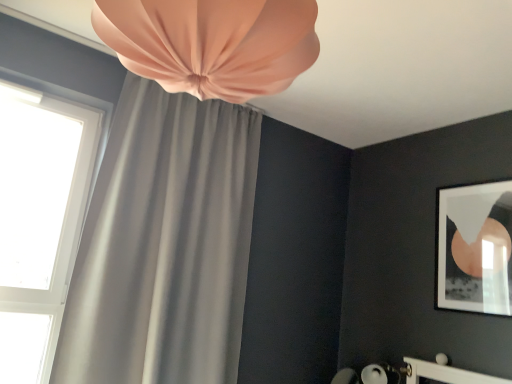
This screenshot has width=512, height=384. In order to click on matte gray curtain at upper left, the 2th curtain in the front-to-back sequence in this screenshot , I will do `click(164, 244)`.

Where is `matte gray curtain at upper left, the first curtain when ordered from front to back`? Image resolution: width=512 pixels, height=384 pixels. matte gray curtain at upper left, the first curtain when ordered from front to back is located at coordinates (212, 43).

Considering the points (498, 197) and (275, 7), which point is behind, point (498, 197) or point (275, 7)?

The point (498, 197) is farther.

Locate an element on the screen. the 2nd curtain in front when counting from the matte black frame at upper right is located at coordinates (212, 43).

Can you confirm if matte black frame at upper right is thinner than matte gray curtain at upper left, the first curtain when ordered from front to back?

Indeed, matte black frame at upper right has a lesser width compared to matte gray curtain at upper left, the first curtain when ordered from front to back.

Measure the distance between matte black frame at upper right and matte gray curtain at upper left, the 2th curtain when ordered from back to front.

They are 1.94 meters apart.

From the image's perspective, between matte gray curtain at upper left, the 2th curtain when ordered from back to front, and white glass window at upper left, who is located below?

white glass window at upper left.

Is matte gray curtain at upper left, the first curtain when ordered from front to back, far from white glass window at upper left?

Yes, matte gray curtain at upper left, the first curtain when ordered from front to back, is far from white glass window at upper left.

Considering the sizes of matte gray curtain at upper left, the first curtain when ordered from front to back, and white glass window at upper left in the image, is matte gray curtain at upper left, the first curtain when ordered from front to back, taller or shorter than white glass window at upper left?

Clearly, matte gray curtain at upper left, the first curtain when ordered from front to back, is shorter compared to white glass window at upper left.

Which object is thinner, matte gray curtain at upper left, the first curtain when ordered from front to back, or white glass window at upper left?

Thinner between the two is white glass window at upper left.

How different are the orientations of matte black frame at upper right and matte gray curtain at upper left, the 2th curtain in the front-to-back sequence, in degrees?

91 degrees.

Which object is further away from the camera taking this photo, matte black frame at upper right or matte gray curtain at upper left, the 1th curtain in the back-to-front sequence?

Positioned behind is matte black frame at upper right.

Is matte black frame at upper right facing towards matte gray curtain at upper left, the 2th curtain in the front-to-back sequence?

No, matte black frame at upper right is not turned towards matte gray curtain at upper left, the 2th curtain in the front-to-back sequence.

Do you think matte black frame at upper right is within matte gray curtain at upper left, the 1th curtain in the back-to-front sequence, or outside of it?

matte black frame at upper right is located beyond the bounds of matte gray curtain at upper left, the 1th curtain in the back-to-front sequence.

Is matte gray curtain at upper left, the 2th curtain when ordered from back to front, next to matte gray curtain at upper left, the 2th curtain in the front-to-back sequence?

No, matte gray curtain at upper left, the 2th curtain when ordered from back to front, is not with matte gray curtain at upper left, the 2th curtain in the front-to-back sequence.

Considering the positions of objects matte gray curtain at upper left, the 2th curtain when ordered from back to front, and matte gray curtain at upper left, the 2th curtain in the front-to-back sequence, in the image provided, who is more to the right, matte gray curtain at upper left, the 2th curtain when ordered from back to front, or matte gray curtain at upper left, the 2th curtain in the front-to-back sequence,?

From the viewer's perspective, matte gray curtain at upper left, the 2th curtain when ordered from back to front, appears more on the right side.

Is matte gray curtain at upper left, the first curtain when ordered from front to back, outside of matte gray curtain at upper left, the 1th curtain in the back-to-front sequence?

That's correct, matte gray curtain at upper left, the first curtain when ordered from front to back, is outside of matte gray curtain at upper left, the 1th curtain in the back-to-front sequence.

Does matte gray curtain at upper left, the 2th curtain when ordered from back to front, turn towards matte gray curtain at upper left, the 1th curtain in the back-to-front sequence?

No, matte gray curtain at upper left, the 2th curtain when ordered from back to front, is not facing towards matte gray curtain at upper left, the 1th curtain in the back-to-front sequence.

Does point (28, 151) come closer to viewer compared to point (182, 338)?

Yes, it is.

From the image's perspective, between white glass window at upper left and matte gray curtain at upper left, the 1th curtain in the back-to-front sequence, who is located below?

matte gray curtain at upper left, the 1th curtain in the back-to-front sequence.

Is the depth of white glass window at upper left less than that of matte gray curtain at upper left, the 2th curtain in the front-to-back sequence?

No, white glass window at upper left is behind matte gray curtain at upper left, the 2th curtain in the front-to-back sequence.

The height and width of the screenshot is (384, 512). I want to click on the 1st curtain in front of the white glass window at upper left, starting your count from the anchor, so click(x=164, y=244).

Does point (34, 254) appear closer or farther from the camera than point (122, 1)?

Point (34, 254) appears to be farther away from the viewer than point (122, 1).

From a real-world perspective, relative to matte gray curtain at upper left, the 2th curtain when ordered from back to front, is white glass window at upper left vertically above or below?

white glass window at upper left is situated lower than matte gray curtain at upper left, the 2th curtain when ordered from back to front, in the real world.

This screenshot has width=512, height=384. I want to click on the 2nd curtain to the right of the white glass window at upper left, starting your count from the anchor, so click(212, 43).

From the image's perspective, between white glass window at upper left and matte gray curtain at upper left, the 2th curtain when ordered from back to front, who is located below?

From the image's view, white glass window at upper left is below.

Considering the sizes of objects matte gray curtain at upper left, the first curtain when ordered from front to back, and matte black frame at upper right in the image provided, who is smaller, matte gray curtain at upper left, the first curtain when ordered from front to back, or matte black frame at upper right?

With smaller size is matte black frame at upper right.

Could you tell me if matte gray curtain at upper left, the first curtain when ordered from front to back, is turned towards matte black frame at upper right?

No, matte gray curtain at upper left, the first curtain when ordered from front to back, is not aimed at matte black frame at upper right.

Which of these two, matte gray curtain at upper left, the 2th curtain when ordered from back to front, or matte black frame at upper right, is thinner?

Thinner between the two is matte black frame at upper right.

Does matte gray curtain at upper left, the first curtain when ordered from front to back, lie behind matte black frame at upper right?

No, matte gray curtain at upper left, the first curtain when ordered from front to back, is closer to the viewer.

The width and height of the screenshot is (512, 384). In order to click on the 2nd curtain in front of the matte black frame at upper right in this screenshot , I will do `click(212, 43)`.

Find the location of `curtain that is the 2nd one when counting rightward from the white glass window at upper left`. curtain that is the 2nd one when counting rightward from the white glass window at upper left is located at coordinates (212, 43).

Looking at the image, which one is located further to white glass window at upper left, matte black frame at upper right or matte gray curtain at upper left, the 2th curtain when ordered from back to front?

matte black frame at upper right lies further to white glass window at upper left than the other object.

From the picture: Based on their spatial positions, is matte gray curtain at upper left, the first curtain when ordered from front to back, or matte black frame at upper right closer to white glass window at upper left?

matte gray curtain at upper left, the first curtain when ordered from front to back.

Considering their positions, is white glass window at upper left positioned closer to matte black frame at upper right than matte gray curtain at upper left, the 2th curtain when ordered from back to front?

The object closer to matte black frame at upper right is matte gray curtain at upper left, the 2th curtain when ordered from back to front.

Estimate the real-world distances between objects in this image. Which object is further from matte gray curtain at upper left, the 2th curtain when ordered from back to front, matte gray curtain at upper left, the 2th curtain in the front-to-back sequence, or matte black frame at upper right?

matte black frame at upper right is further to matte gray curtain at upper left, the 2th curtain when ordered from back to front.

Looking at the image, which one is located further to matte gray curtain at upper left, the first curtain when ordered from front to back, matte black frame at upper right or white glass window at upper left?

Among the two, matte black frame at upper right is located further to matte gray curtain at upper left, the first curtain when ordered from front to back.

When comparing their distances from matte gray curtain at upper left, the first curtain when ordered from front to back, does white glass window at upper left or matte black frame at upper right seem closer?

white glass window at upper left is closer to matte gray curtain at upper left, the first curtain when ordered from front to back.

Estimate the real-world distances between objects in this image. Which object is further from matte gray curtain at upper left, the 1th curtain in the back-to-front sequence, white glass window at upper left or matte gray curtain at upper left, the 2th curtain when ordered from back to front?

matte gray curtain at upper left, the 2th curtain when ordered from back to front, lies further to matte gray curtain at upper left, the 1th curtain in the back-to-front sequence, than the other object.

From the image, which object appears to be farther from matte gray curtain at upper left, the 2th curtain in the front-to-back sequence, white glass window at upper left or matte black frame at upper right?

matte black frame at upper right is positioned further to the anchor matte gray curtain at upper left, the 2th curtain in the front-to-back sequence.

Locate an element on the screen. This screenshot has width=512, height=384. curtain situated between matte gray curtain at upper left, the 2th curtain in the front-to-back sequence, and matte black frame at upper right from left to right is located at coordinates (212, 43).

Find the location of a particular element. curtain located between matte gray curtain at upper left, the 2th curtain when ordered from back to front, and white glass window at upper left in the depth direction is located at coordinates (164, 244).